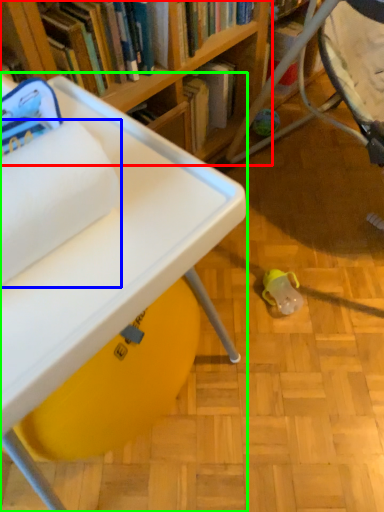
Question: Estimate the real-world distances between objects in this image. Which object is closer to bookcase (highlighted by a red box), toilet paper (highlighted by a blue box) or table (highlighted by a green box)?

Choices:
 (A) toilet paper
 (B) table

Answer: (B)